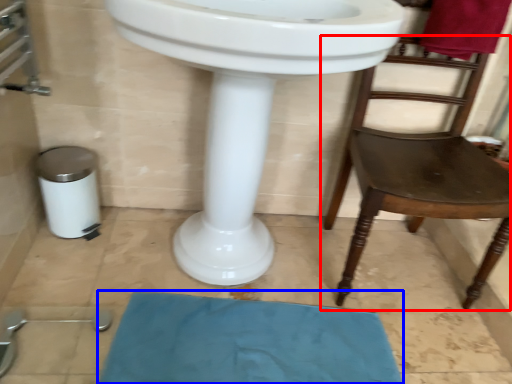
Question: Which of the following is the farthest to the observer, chair (highlighted by a red box) or bath mat (highlighted by a blue box)?

Choices:
 (A) chair
 (B) bath mat

Answer: (B)